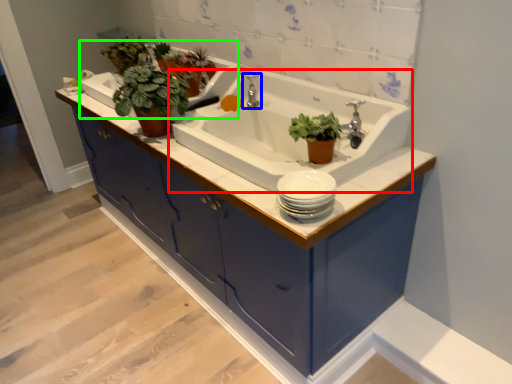
Question: Estimate the real-world distances between objects in this image. Which object is closer to sink (highlighted by a red box), tap (highlighted by a blue box) or bath (highlighted by a green box)?

Choices:
 (A) tap
 (B) bath

Answer: (A)